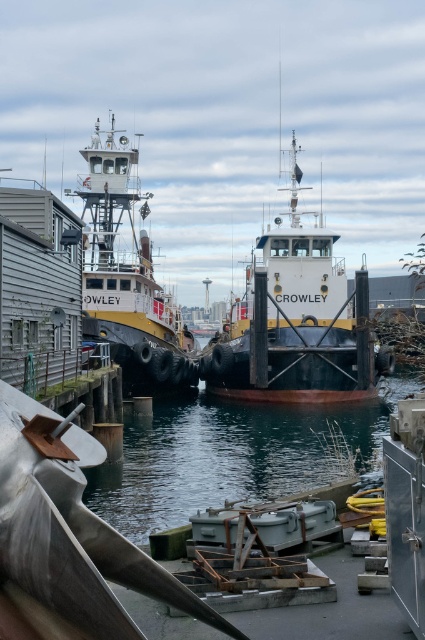
Question: Observing the image, what is the correct spatial positioning of clear water at center in reference to yellow matte tugboat at left?

Choices:
 (A) right
 (B) left

Answer: (A)

Question: Can you confirm if clear water at center is positioned to the right of yellow matte tugboat at left?

Choices:
 (A) no
 (B) yes

Answer: (B)

Question: Is clear water at center closer to the viewer compared to yellow matte tugboat at left?

Choices:
 (A) no
 (B) yes

Answer: (B)

Question: Which point is farther from the camera taking this photo?

Choices:
 (A) (184, 326)
 (B) (235, 465)

Answer: (A)